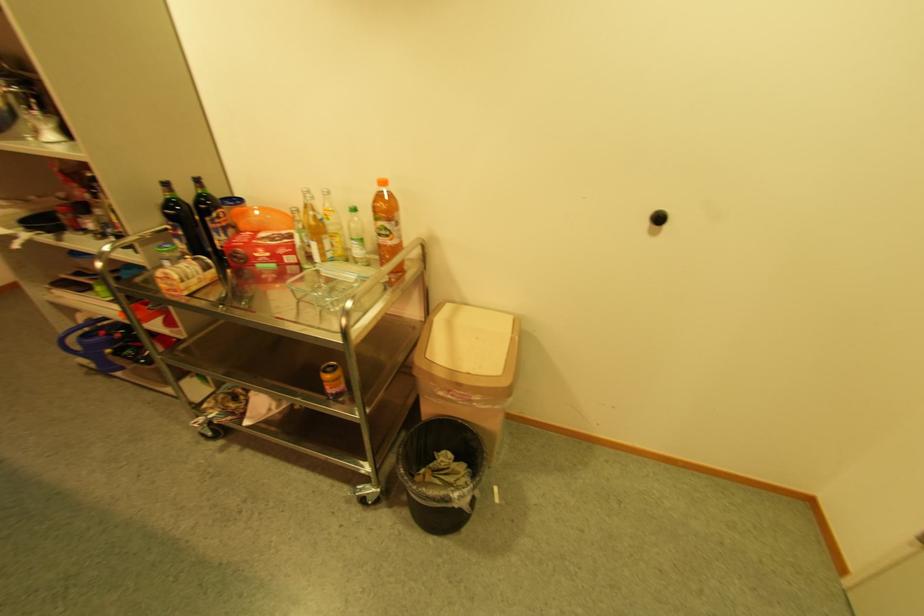
The location [333,379] corresponds to which object?

This point indicates the beverage can.